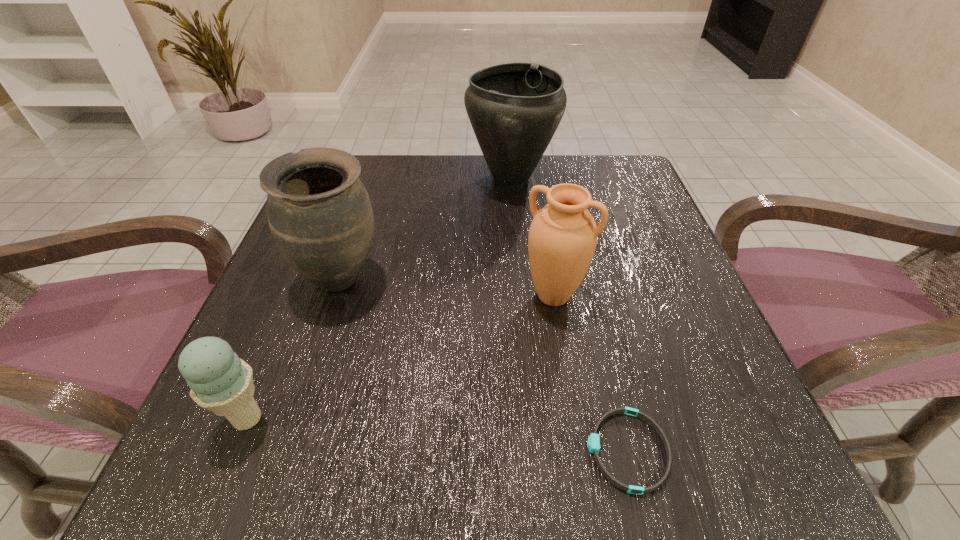
This screenshot has height=540, width=960. What are the coordinates of `the farthest urn` in the screenshot? It's located at (515, 108).

At what (x,y) coordinates should I click in order to perform the action: click on the leftmost urn. Please return your answer as a coordinate pair (x, y). The height and width of the screenshot is (540, 960). Looking at the image, I should click on (319, 212).

Find the location of a particular element. the second shortest object is located at coordinates (221, 382).

Where is `the shortest object`? The height and width of the screenshot is (540, 960). the shortest object is located at coordinates (593, 443).

I want to click on free space located on the right of the farthest object, so click(634, 178).

I want to click on blank space located on the back of the leftmost urn, so click(x=370, y=190).

Identify the location of free space located 0.300m on the back of the ice cream. coord(315,255).

This screenshot has width=960, height=540. What are the coordinates of `free point located 0.170m on the buckle of the wristband` in the screenshot? It's located at (453, 450).

The image size is (960, 540). In order to click on vacant area situated 0.290m on the buckle of the wristband in this screenshot , I will do `click(359, 450)`.

The height and width of the screenshot is (540, 960). What are the coordinates of `free region located on the buckle of the wristband` in the screenshot? It's located at (414, 450).